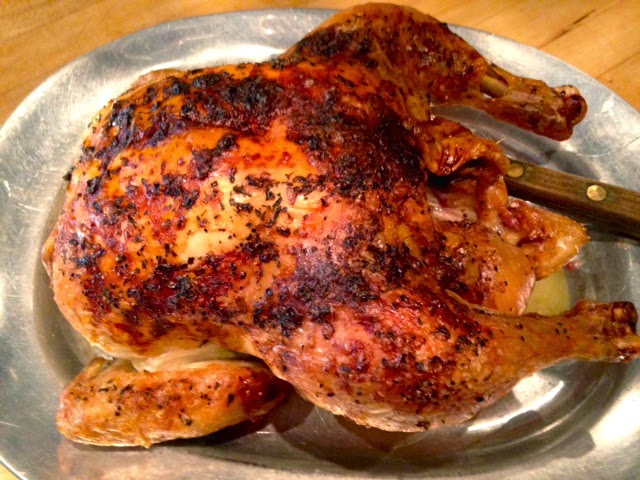
At what (x,y) coordinates should I click in order to perform the action: click on cooked food. Please return your answer as a coordinate pair (x, y). This screenshot has width=640, height=480. Looking at the image, I should click on (253, 184).